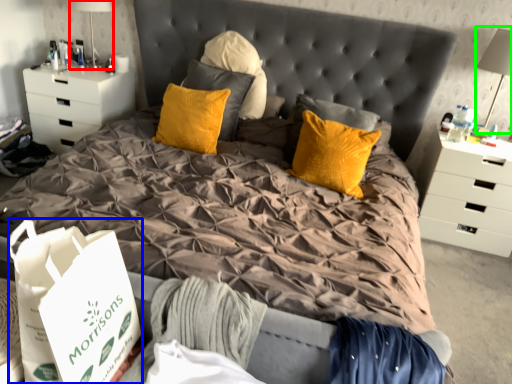
Question: Based on their relative distances, which object is farther from table lamp (highlighted by a red box)? Choose from shopping bag (highlighted by a blue box) and table lamp (highlighted by a green box).

Choices:
 (A) shopping bag
 (B) table lamp

Answer: (B)